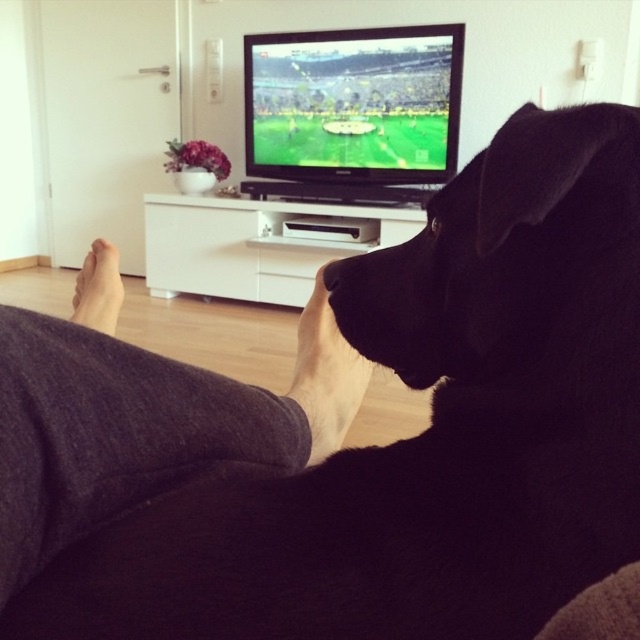
Question: Among these objects, which one is farthest from the camera?

Choices:
 (A) white matte entertainment center at center
 (B) black matte skin at lower center
 (C) green grass field at center
 (D) black smooth nose at lower center

Answer: (C)

Question: Does green grass field at center come in front of white matte entertainment center at center?

Choices:
 (A) no
 (B) yes

Answer: (A)

Question: Which point appears farthest from the camera in this image?

Choices:
 (A) (408, 157)
 (B) (336, 260)
 (C) (316, 339)

Answer: (A)

Question: Is white matte entertainment center at center bigger than skinny flesh-toned foot at lower left?

Choices:
 (A) no
 (B) yes

Answer: (B)

Question: Is dark gray fabric leg at lower left thinner than black matte skin at lower center?

Choices:
 (A) no
 (B) yes

Answer: (A)

Question: Which point appears farthest from the camera in this image?

Choices:
 (A) (454, 120)
 (B) (100, 256)
 (C) (321, 422)

Answer: (A)